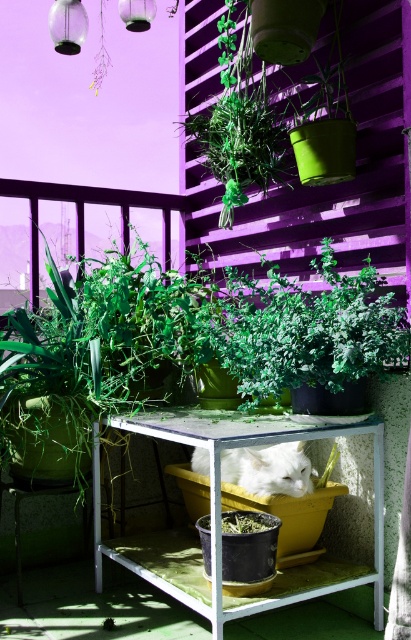
Question: Where is white metal table at center located in relation to white fluffy cat at center in the image?

Choices:
 (A) above
 (B) below

Answer: (B)

Question: Among these points, which one is nearest to the camera?

Choices:
 (A) (150, 422)
 (B) (281, 486)

Answer: (B)

Question: Does white metal table at center appear over white fluffy cat at center?

Choices:
 (A) yes
 (B) no

Answer: (B)

Question: Which object is closer to the camera taking this photo?

Choices:
 (A) white metal table at center
 (B) white fluffy cat at center

Answer: (A)

Question: Is white metal table at center positioned before white fluffy cat at center?

Choices:
 (A) yes
 (B) no

Answer: (A)